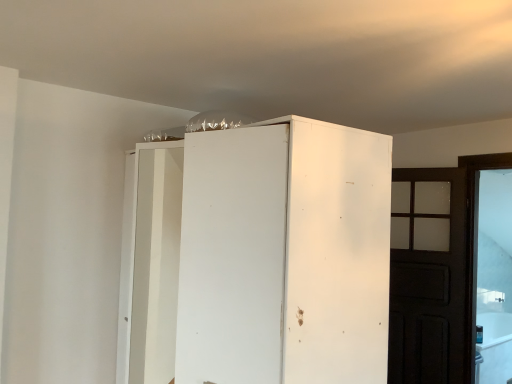
Question: Is dark wood door at right situated inside white matte cabinet at center or outside?

Choices:
 (A) inside
 (B) outside

Answer: (B)

Question: Would you say dark wood door at right is to the left or to the right of white matte cabinet at center in the picture?

Choices:
 (A) right
 (B) left

Answer: (A)

Question: From the image's perspective, is dark wood door at right located above or below white matte cabinet at center?

Choices:
 (A) above
 (B) below

Answer: (B)

Question: Is white matte cabinet at center taller or shorter than dark wood door at right?

Choices:
 (A) short
 (B) tall

Answer: (A)

Question: From the image's perspective, is white matte cabinet at center above or below dark wood door at right?

Choices:
 (A) below
 (B) above

Answer: (B)

Question: Choose the correct answer: Is white matte cabinet at center inside dark wood door at right or outside it?

Choices:
 (A) inside
 (B) outside

Answer: (B)

Question: Based on their sizes in the image, would you say white matte cabinet at center is bigger or smaller than dark wood door at right?

Choices:
 (A) small
 (B) big

Answer: (B)